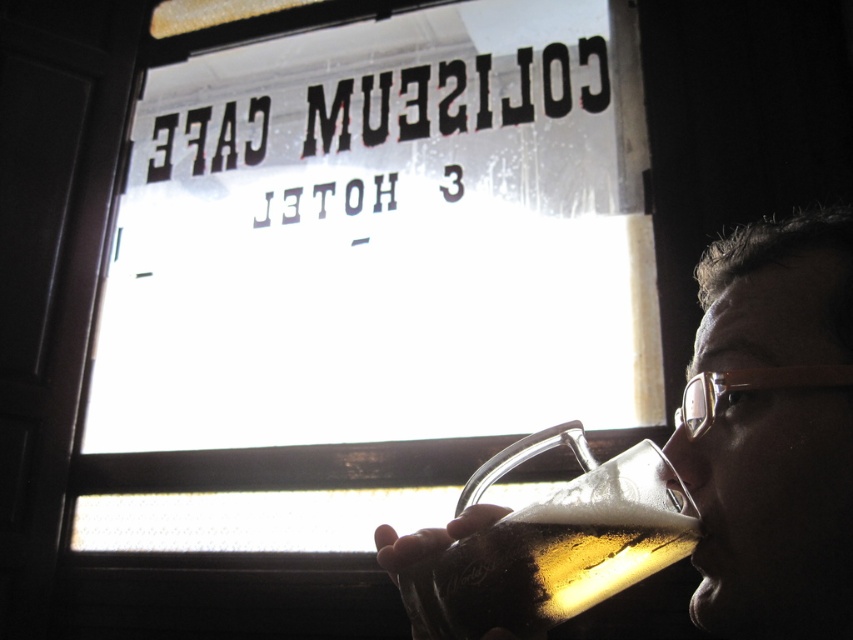
Between translucent glass mug at upper center and translucent glass mug at lower center, which one has less height?

translucent glass mug at lower center

Is translucent glass mug at upper center bigger than translucent glass mug at lower center?

Indeed, translucent glass mug at upper center has a larger size compared to translucent glass mug at lower center.

The height and width of the screenshot is (640, 853). In order to click on translucent glass mug at upper center in this screenshot , I will do `click(772, 429)`.

Locate an element on the screen. Image resolution: width=853 pixels, height=640 pixels. translucent glass mug at upper center is located at coordinates (772, 429).

Can you confirm if transparent glass window at center is bigger than translucent glass mug at lower center?

Yes, transparent glass window at center is bigger than translucent glass mug at lower center.

Looking at this image, between transparent glass window at center and translucent glass mug at lower center, which one appears on the left side from the viewer's perspective?

From the viewer's perspective, transparent glass window at center appears more on the left side.

Identify the location of transparent glass window at center. click(368, 275).

Does transparent glass window at center appear under translucent glass mug at upper center?

No.

Between transparent glass window at center and translucent glass mug at upper center, which one appears on the left side from the viewer's perspective?

transparent glass window at center

Between point (482, 76) and point (715, 604), which one is positioned in front?

Point (715, 604) is more forward.

Where is `transparent glass window at center`? transparent glass window at center is located at coordinates (368, 275).